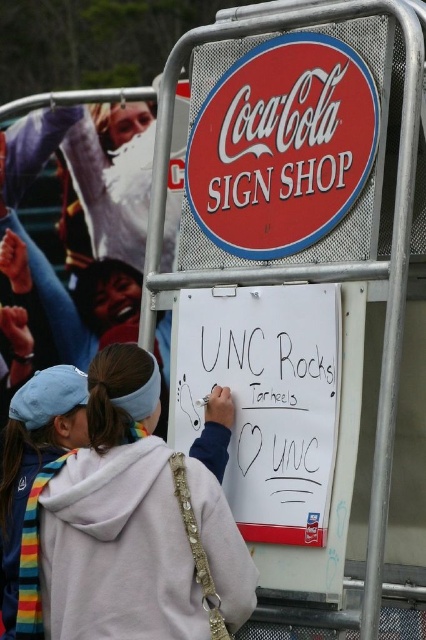
Question: Where is red plastic coca-cola sign shop at upper center located in relation to white paperboard at center in the image?

Choices:
 (A) below
 (B) above

Answer: (B)

Question: Among these objects, which one is nearest to the camera?

Choices:
 (A) white paperboard at center
 (B) red plastic coca-cola sign shop at upper center
 (C) white fleece hoodie at center

Answer: (C)

Question: Can you confirm if white fleece hoodie at center is thinner than red plastic coca-cola sign shop at upper center?

Choices:
 (A) yes
 (B) no

Answer: (B)

Question: Which of the following is the farthest from the observer?

Choices:
 (A) (317, 449)
 (B) (199, 125)

Answer: (B)

Question: Which of the following is the closest to the observer?

Choices:
 (A) (304, 419)
 (B) (204, 632)

Answer: (B)

Question: Can you confirm if red plastic coca-cola sign shop at upper center is wider than white paperboard at center?

Choices:
 (A) yes
 (B) no

Answer: (A)